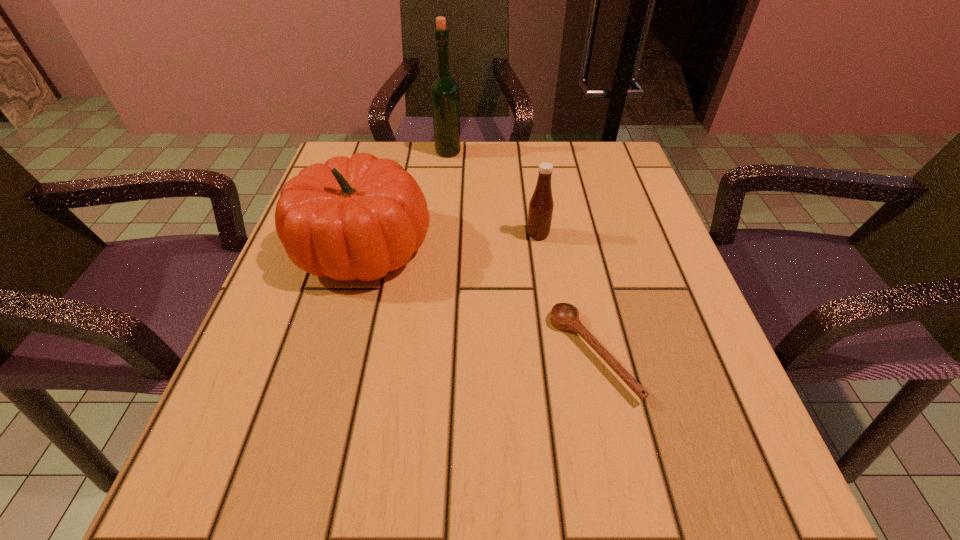
I want to click on blank region between the Tabasco sauce and the pumpkin, so click(x=450, y=241).

Where is `vacant space that's between the Tabasco sauce and the tallest object`? vacant space that's between the Tabasco sauce and the tallest object is located at coordinates (493, 193).

This screenshot has height=540, width=960. In order to click on free space that is in between the Tabasco sauce and the tallest object in this screenshot , I will do `click(493, 193)`.

Identify the location of vacant area between the farthest object and the Tabasco sauce. This screenshot has height=540, width=960. (493, 193).

The width and height of the screenshot is (960, 540). I want to click on free space between the pumpkin and the Tabasco sauce, so click(450, 241).

In order to click on vacant area that lies between the Tabasco sauce and the farthest object in this screenshot , I will do `click(493, 193)`.

Where is `empty location between the Tabasco sauce and the farthest object`? This screenshot has width=960, height=540. empty location between the Tabasco sauce and the farthest object is located at coordinates (493, 193).

This screenshot has height=540, width=960. In order to click on unoccupied position between the farthest object and the nearest object in this screenshot , I will do `click(520, 253)`.

The height and width of the screenshot is (540, 960). I want to click on object identified as the third closest to the liquor, so click(564, 316).

Where is `object that stands as the third closest to the farthest object`? object that stands as the third closest to the farthest object is located at coordinates (564, 316).